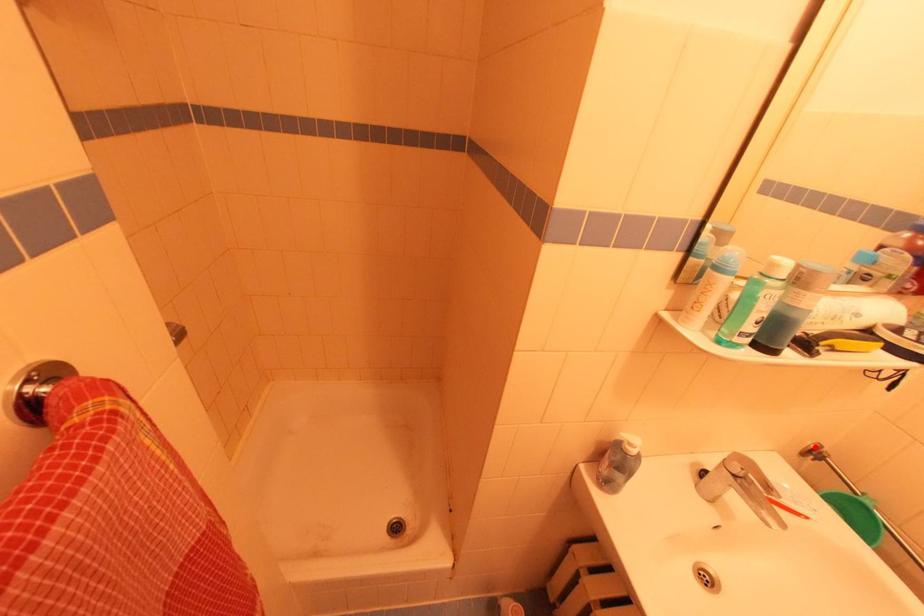
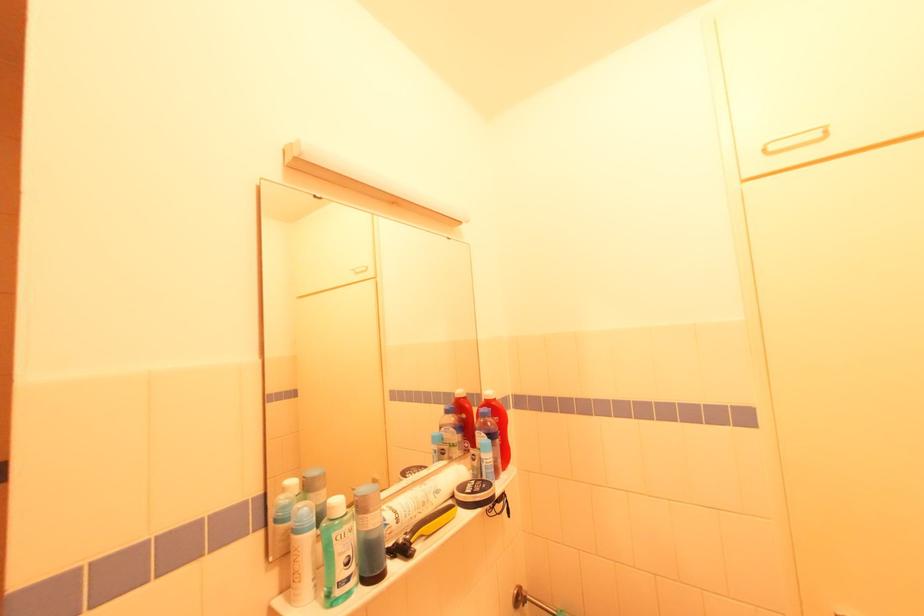
Find the pixel in the second image that matches the highlighted location in the first image.

(517, 594)